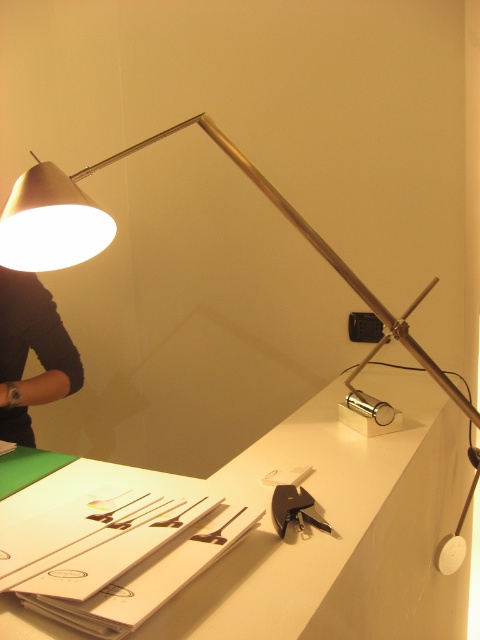
You are organizing items on a desk and need to place a new item between the matte silver lamp at upper left and the metallic keychain at lower center. Can you fit it there?

The matte silver lamp at upper left is to the left of metallic keychain at lower center, so there is space between them to place a new item.

In the scene shown: You are organizing items on a desk and need to place a new item between the matte silver lamp at upper left and the metallic keychain at lower center. Considering their sizes, which object should you place closer to the edge of the desk to ensure stability?

The matte silver lamp at upper left is taller than the metallic keychain at lower center. To ensure stability, place the taller matte silver lamp at upper left closer to the edge since its height provides better balance, while the shorter keychain can be positioned further inward.

You are organizing items on the desk and need to place a new item that requires a surface at least as tall as the matte silver lamp at upper left. Can the white glossy table at center accommodate this requirement?

The white glossy table at center is taller than the matte silver lamp at upper left, so it can accommodate the new item requiring a surface at least as tall as the matte silver lamp at upper left.